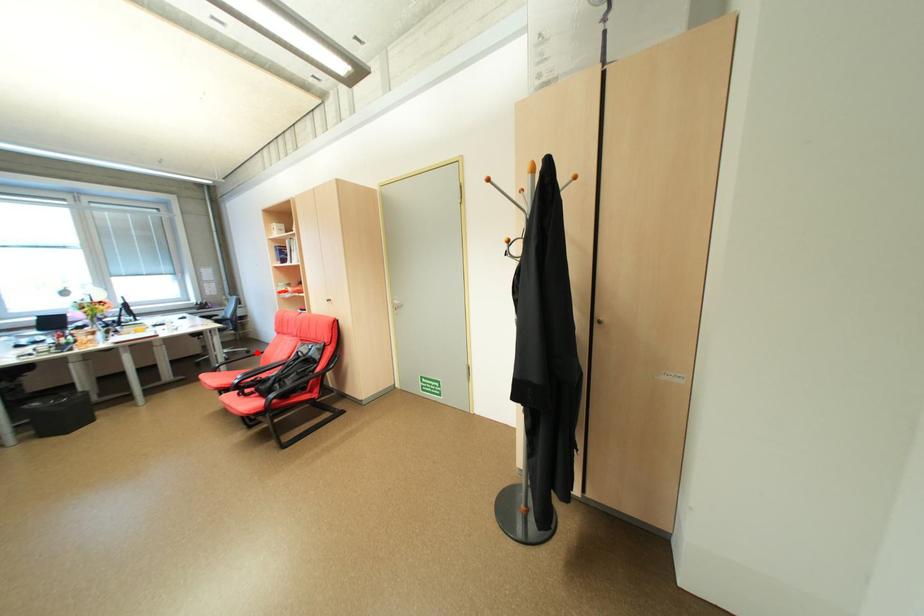
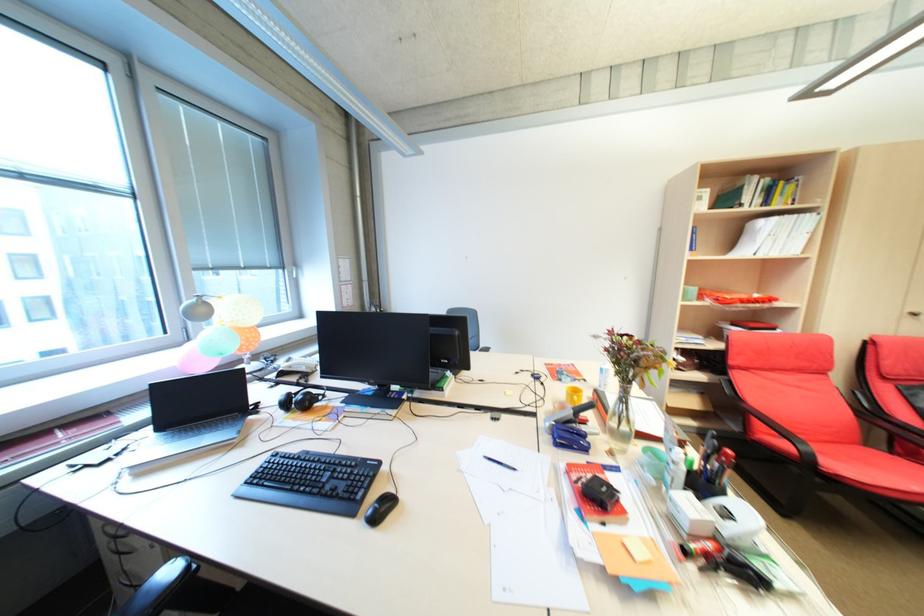
Question: I am providing you with two images of the same scene from different viewpoints. A red point is marked on the first image. Is the red point's position out of view in image 2?

Choices:
 (A) Yes
 (B) No

Answer: (A)